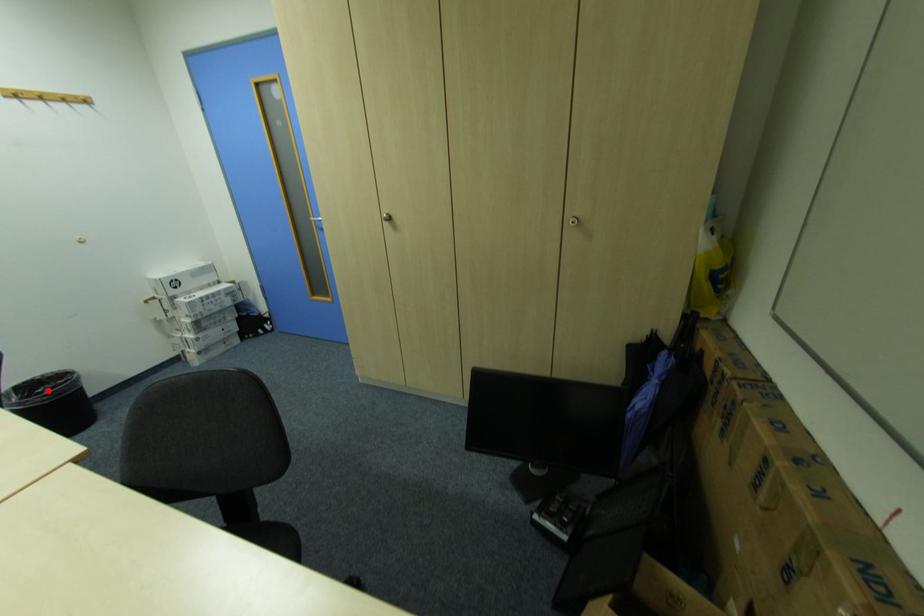
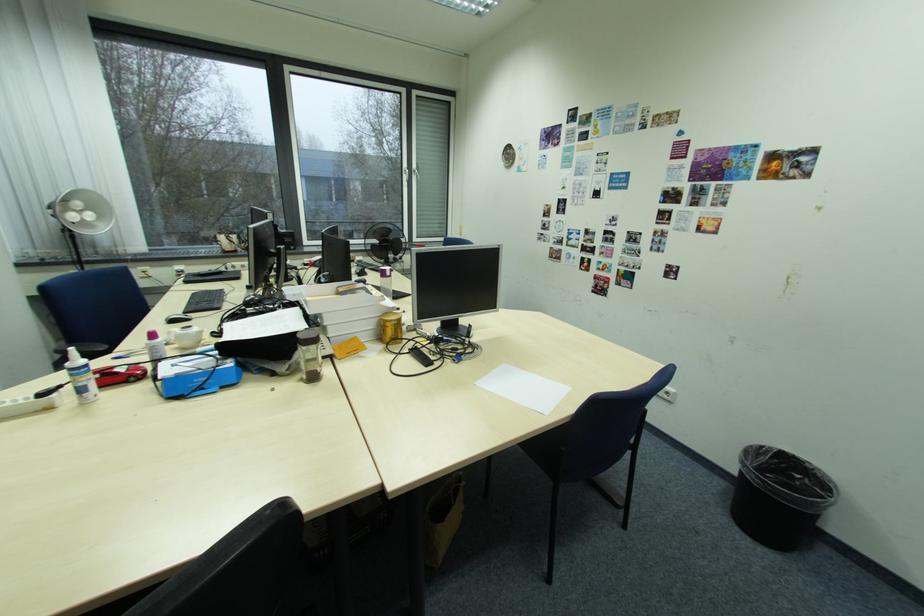
Question: I am providing you with two images of the same scene from different viewpoints. In image1, a red point is highlighted. Considering the same 3D point in image2, which of the following is correct?

Choices:
 (A) It is closer
 (B) It is farther

Answer: (A)